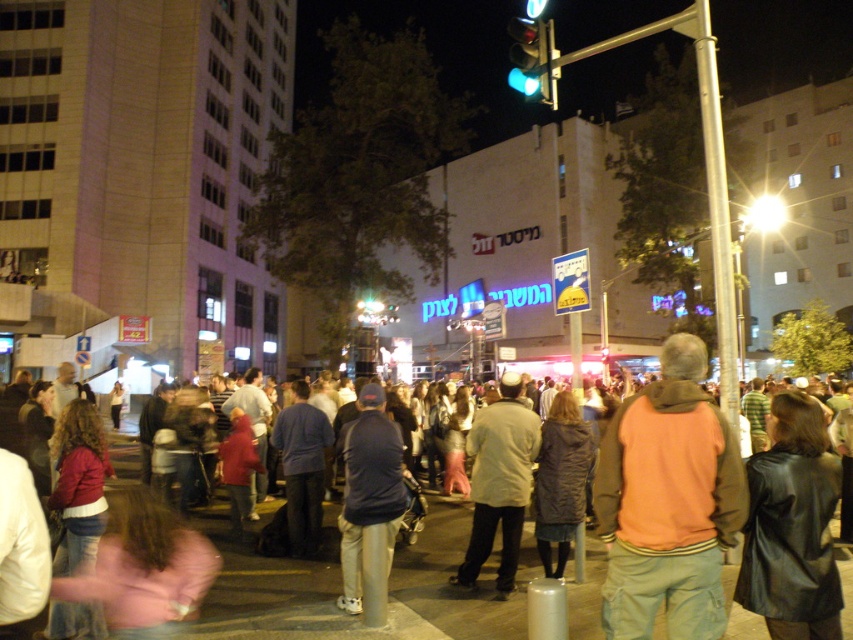
Can you confirm if dark gray jacket at center is smaller than green glass traffic light at upper center?

Correct, dark gray jacket at center occupies less space than green glass traffic light at upper center.

Between dark gray jacket at center and green glass traffic light at upper center, which one has less height?

dark gray jacket at center

This screenshot has width=853, height=640. Describe the element at coordinates (451, 570) in the screenshot. I see `dark gray jacket at center` at that location.

This screenshot has width=853, height=640. Find the location of `dark gray jacket at center`. dark gray jacket at center is located at coordinates (451, 570).

Is dark gray jacket at center bigger than black leather jacket at lower right?

Indeed, dark gray jacket at center has a larger size compared to black leather jacket at lower right.

Is dark gray jacket at center taller than black leather jacket at lower right?

Yes, dark gray jacket at center is taller than black leather jacket at lower right.

What do you see at coordinates (451, 570) in the screenshot?
I see `dark gray jacket at center` at bounding box center [451, 570].

Locate an element on the screen. dark gray jacket at center is located at coordinates (451, 570).

Between black leather jacket at lower right and light brown leather jacket at center, which one is positioned higher?

black leather jacket at lower right is higher up.

Is black leather jacket at lower right behind light brown leather jacket at center?

No, black leather jacket at lower right is in front of light brown leather jacket at center.

The image size is (853, 640). What are the coordinates of `black leather jacket at lower right` in the screenshot? It's located at click(x=792, y=525).

Find the location of a particular element. This screenshot has width=853, height=640. black leather jacket at lower right is located at coordinates (792, 525).